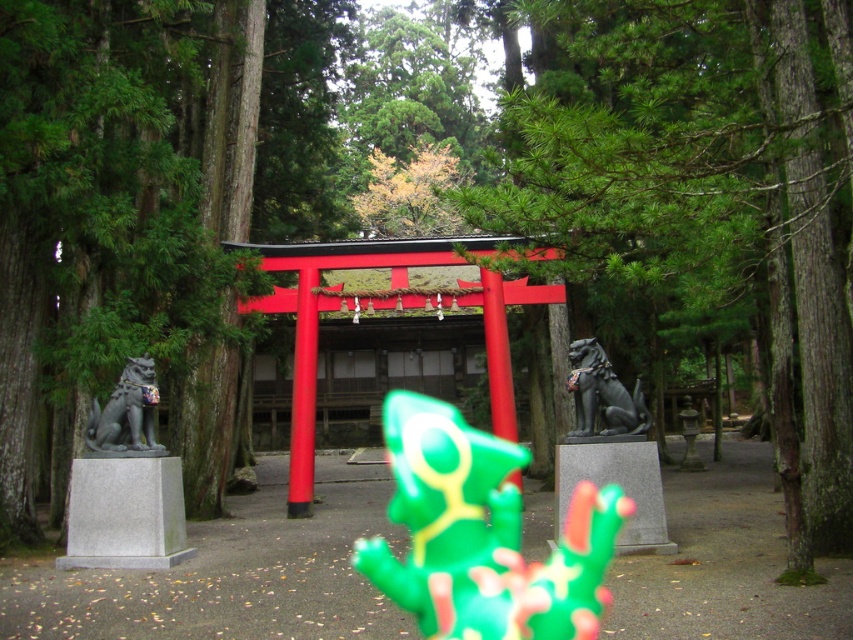
Question: Which object appears closest to the camera in this image?

Choices:
 (A) green rubber frog at center
 (B) gray stone dog at left
 (C) shiny black stone dog at center
 (D) green leafy tree at center

Answer: (D)

Question: Estimate the real-world distances between objects in this image. Which object is closer to the shiny black stone dog at center?

Choices:
 (A) gray stone dog at left
 (B) green rubber frog at center
 (C) green leafy tree at center

Answer: (C)

Question: Where is green rubber frog at center located in relation to gray stone dog at left in the image?

Choices:
 (A) left
 (B) right

Answer: (B)

Question: Which object is closer to the camera taking this photo?

Choices:
 (A) gray stone dog at left
 (B) green rubber frog at center
 (C) green leafy tree at center
 (D) shiny black stone dog at center

Answer: (C)

Question: Is green rubber frog at center smaller than shiny black stone dog at center?

Choices:
 (A) no
 (B) yes

Answer: (A)

Question: Does green leafy tree at center come in front of green rubber frog at center?

Choices:
 (A) no
 (B) yes

Answer: (B)